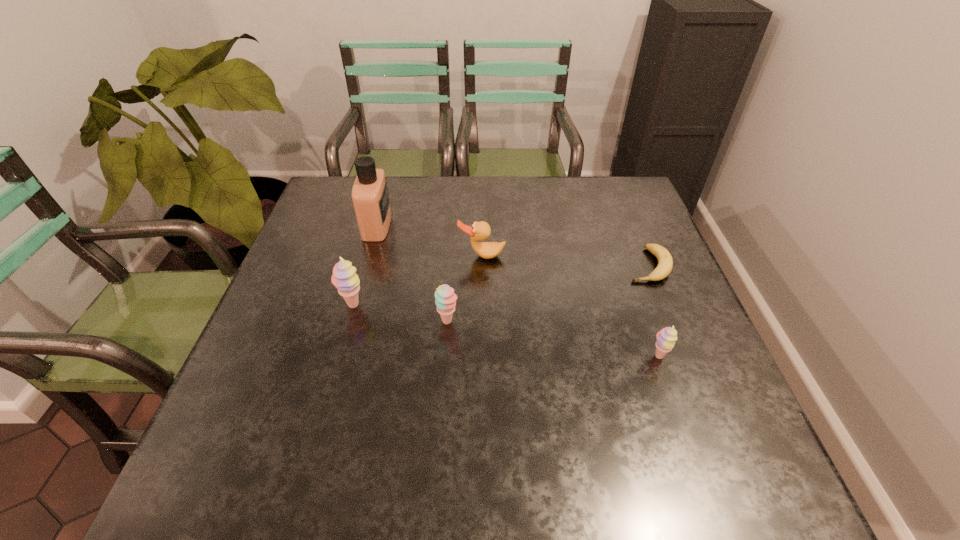
To make them evenly spaced by inserting another sherbert among them, please locate a vacant spot for this new sherbert. Please provide its 2D coordinates. Your answer should be formatted as a tuple, i.e. [(x, y)], where the tuple contains the x and y coordinates of a point satisfying the conditions above.

[(549, 339)]